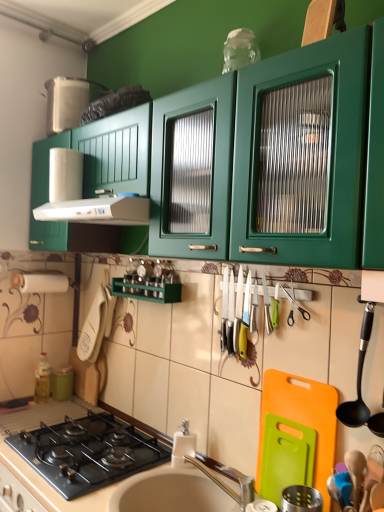
At what (x,y) coordinates should I click in order to perform the action: click on vacant area on top of beige matte countertop at lower center (from a real-world perspective). Please return your answer as a coordinate pair (x, y). Looking at the image, I should click on (81, 440).